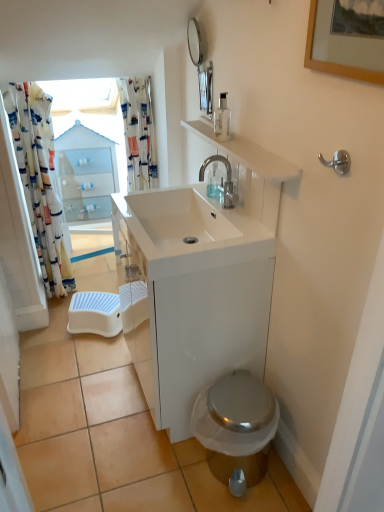
Based on the photo, how much space does printed fabric shower curtain at upper left, which appears as the second shower curtain when viewed from the left, occupy horizontally?

It is 15.84 centimeters.

Image resolution: width=384 pixels, height=512 pixels. Identify the location of white glossy cabinet at center. (194, 296).

Locate an element on the screen. white glossy cabinet at upper center is located at coordinates (87, 181).

Find the location of `transparent glass soap dispenser at upper center`. transparent glass soap dispenser at upper center is located at coordinates (222, 119).

What are the coordinates of `white plastic step stool at lower left` in the screenshot? It's located at (95, 313).

Describe the element at coordinates (95, 313) in the screenshot. I see `white plastic step stool at lower left` at that location.

The height and width of the screenshot is (512, 384). In order to click on printed fabric shower curtain at upper left, which appears as the second shower curtain when viewed from the left in this screenshot , I will do `click(138, 133)`.

Which object is wider, silver metallic hook at upper right or white glossy sink at center?

white glossy sink at center.

Considering the sizes of objects silver metallic hook at upper right and white glossy sink at center in the image provided, who is taller, silver metallic hook at upper right or white glossy sink at center?

With more height is white glossy sink at center.

Could you tell me if silver metallic hook at upper right is turned towards white glossy sink at center?

No, silver metallic hook at upper right is not oriented towards white glossy sink at center.

Find the location of a particular element. sink below the silver metallic hook at upper right (from the image's perspective) is located at coordinates (188, 232).

Is shiny metallic toilet at lower right at the back of silver metallic mirror at upper center?

That's not correct — silver metallic mirror at upper center is not looking away from shiny metallic toilet at lower right.

Does silver metallic mirror at upper center have a lesser width compared to shiny metallic toilet at lower right?

Yes.

From the image's perspective, does silver metallic mirror at upper center appear lower than shiny metallic toilet at lower right?

No.

Considering their positions, is silver metallic mirror at upper center located in front of or behind shiny metallic toilet at lower right?

Clearly, silver metallic mirror at upper center is behind shiny metallic toilet at lower right.

Can you tell me how much white printed fabric shower curtain at left, placed as the first shower curtain when sorted from left to right, and white glossy cabinet at upper center differ in facing direction?

They differ by 3.33 degrees in their facing directions.

Considering the relative sizes of white printed fabric shower curtain at left, placed as the first shower curtain when sorted from left to right, and white glossy cabinet at upper center in the image provided, is white printed fabric shower curtain at left, placed as the first shower curtain when sorted from left to right, taller than white glossy cabinet at upper center?

Indeed, white printed fabric shower curtain at left, placed as the first shower curtain when sorted from left to right, has a greater height compared to white glossy cabinet at upper center.

Can you confirm if white printed fabric shower curtain at left, placed as the first shower curtain when sorted from left to right, is positioned to the right of white glossy cabinet at upper center?

No, white printed fabric shower curtain at left, placed as the first shower curtain when sorted from left to right, is not to the right of white glossy cabinet at upper center.

Is white printed fabric shower curtain at left, placed as the first shower curtain when sorted from left to right, bigger than white glossy cabinet at upper center?

Actually, white printed fabric shower curtain at left, placed as the first shower curtain when sorted from left to right, might be smaller than white glossy cabinet at upper center.

Which is behind, printed fabric shower curtain at upper left, which appears as the second shower curtain when viewed from the left, or white plastic step stool at lower left?

white plastic step stool at lower left is behind.

Considering the relative sizes of printed fabric shower curtain at upper left, which appears as the second shower curtain when viewed from the left, and white plastic step stool at lower left in the image provided, is printed fabric shower curtain at upper left, which appears as the second shower curtain when viewed from the left, shorter than white plastic step stool at lower left?

No, printed fabric shower curtain at upper left, which appears as the second shower curtain when viewed from the left, is not shorter than white plastic step stool at lower left.

From the image's perspective, is white glossy cabinet at upper center under wooden picture frame at upper right?

Yes, from the image's perspective, white glossy cabinet at upper center is below wooden picture frame at upper right.

Considering the relative sizes of white glossy cabinet at upper center and wooden picture frame at upper right in the image provided, is white glossy cabinet at upper center bigger than wooden picture frame at upper right?

Correct, white glossy cabinet at upper center is larger in size than wooden picture frame at upper right.

Is white glossy cabinet at upper center shorter than wooden picture frame at upper right?

No.

Considering the relative sizes of metallic silver trash can at lower right and white glossy cabinet at upper center in the image provided, is metallic silver trash can at lower right shorter than white glossy cabinet at upper center?

Correct, metallic silver trash can at lower right is not as tall as white glossy cabinet at upper center.

From the image's perspective, who appears lower, metallic silver trash can at lower right or white glossy cabinet at upper center?

From the image's view, metallic silver trash can at lower right is below.

Is metallic silver trash can at lower right looking in the opposite direction of white glossy cabinet at upper center?

metallic silver trash can at lower right does not have its back to white glossy cabinet at upper center.

From a real-world perspective, does white plastic step stool at lower left stand above printed fabric shower curtain at upper left, which appears as the second shower curtain when viewed from the left?

No, from a real-world perspective, white plastic step stool at lower left is not above printed fabric shower curtain at upper left, which appears as the second shower curtain when viewed from the left.

Looking at this image, considering the sizes of objects white plastic step stool at lower left and printed fabric shower curtain at upper left, acting as the 1th shower curtain starting from the right, in the image provided, who is smaller, white plastic step stool at lower left or printed fabric shower curtain at upper left, acting as the 1th shower curtain starting from the right,?

Smaller between the two is white plastic step stool at lower left.

Would you consider white plastic step stool at lower left to be distant from printed fabric shower curtain at upper left, acting as the 1th shower curtain starting from the right?

white plastic step stool at lower left is actually quite close to printed fabric shower curtain at upper left, acting as the 1th shower curtain starting from the right.

Can you tell me how much white plastic step stool at lower left and printed fabric shower curtain at upper left, which appears as the second shower curtain when viewed from the left, differ in facing direction?

white plastic step stool at lower left and printed fabric shower curtain at upper left, which appears as the second shower curtain when viewed from the left, are facing 28.2 degrees away from each other.

At what (x,y) coordinates should I click in order to perform the action: click on sink below the silver metallic hook at upper right (from the image's perspective). Please return your answer as a coordinate pair (x, y). Looking at the image, I should click on (188, 232).

In order to click on toilet that is on the right side of silver metallic mirror at upper center in this screenshot , I will do `click(236, 428)`.

Which object lies nearer to the anchor point silver metallic mirror at upper center, white plastic step stool at lower left or shiny metallic toilet at lower right?

white plastic step stool at lower left lies closer to silver metallic mirror at upper center than the other object.

Estimate the real-world distances between objects in this image. Which object is closer to transparent glass soap dispenser at upper center, silver metallic hook at upper right or satin nickel faucet at center?

satin nickel faucet at center is positioned closer to the anchor transparent glass soap dispenser at upper center.

From the image, which object appears to be farther from satin nickel faucet at center, white printed fabric shower curtain at left, positioned as the second shower curtain in right-to-left order, or shiny metallic toilet at lower right?

white printed fabric shower curtain at left, positioned as the second shower curtain in right-to-left order.

From the image, which object appears to be nearer to white printed fabric shower curtain at left, placed as the first shower curtain when sorted from left to right, wooden picture frame at upper right or silver metallic mirror at upper center?

silver metallic mirror at upper center.

When comparing their distances from white glossy cabinet at center, does white plastic step stool at lower left or white printed fabric shower curtain at left, positioned as the second shower curtain in right-to-left order, seem closer?

The object closer to white glossy cabinet at center is white plastic step stool at lower left.

Based on their spatial positions, is silver metallic mirror at upper center or printed fabric shower curtain at upper left, which appears as the second shower curtain when viewed from the left, further from silver metallic hook at upper right?

printed fabric shower curtain at upper left, which appears as the second shower curtain when viewed from the left.

Estimate the real-world distances between objects in this image. Which object is closer to wooden picture frame at upper right, white plastic step stool at lower left or white glossy cabinet at upper center?

white plastic step stool at lower left is closer to wooden picture frame at upper right.

Looking at the image, which one is located closer to printed fabric shower curtain at upper left, acting as the 1th shower curtain starting from the right, shiny metallic toilet at lower right or transparent glass soap dispenser at upper center?

Among the two, transparent glass soap dispenser at upper center is located nearer to printed fabric shower curtain at upper left, acting as the 1th shower curtain starting from the right.

At what (x,y) coordinates should I click in order to perform the action: click on sink between transparent glass soap dispenser at upper center and white glossy cabinet at center in the up-down direction. Please return your answer as a coordinate pair (x, y). This screenshot has width=384, height=512. Looking at the image, I should click on (188, 232).

You are a GUI agent. You are given a task and a screenshot of the screen. Output one action in this format:
    pyautogui.click(x=<x>, y=<y>)
    Task: Click on the tap between wooden picture frame at upper right and metallic silver trash can at lower right in the vertical direction
    
    Given the screenshot: What is the action you would take?
    pyautogui.click(x=226, y=180)

The image size is (384, 512). I want to click on bathroom cabinet that lies between clear plastic soap dispenser at center and metallic silver trash can at lower right from top to bottom, so pyautogui.click(x=194, y=296).

The height and width of the screenshot is (512, 384). I want to click on sink that lies between white printed fabric shower curtain at left, positioned as the second shower curtain in right-to-left order, and metallic silver trash can at lower right from top to bottom, so click(188, 232).